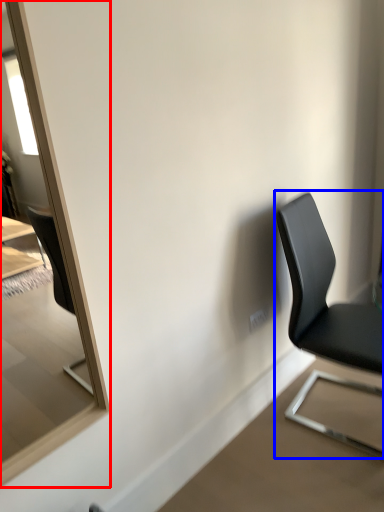
Question: Which of the following is the farthest to the observer, mirror (highlighted by a red box) or chair (highlighted by a blue box)?

Choices:
 (A) mirror
 (B) chair

Answer: (B)